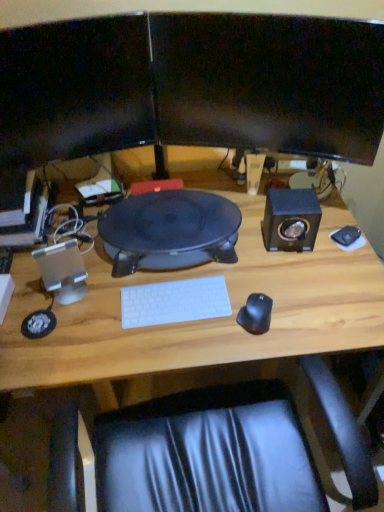
At what (x,y) coordinates should I click in order to perform the action: click on vacant area that lies between black matte speaker at right, arranged as the first speaker when viewed from the top, and white plastic keyboard at center. Please return your answer as a coordinate pair (x, y). Looking at the image, I should click on (235, 268).